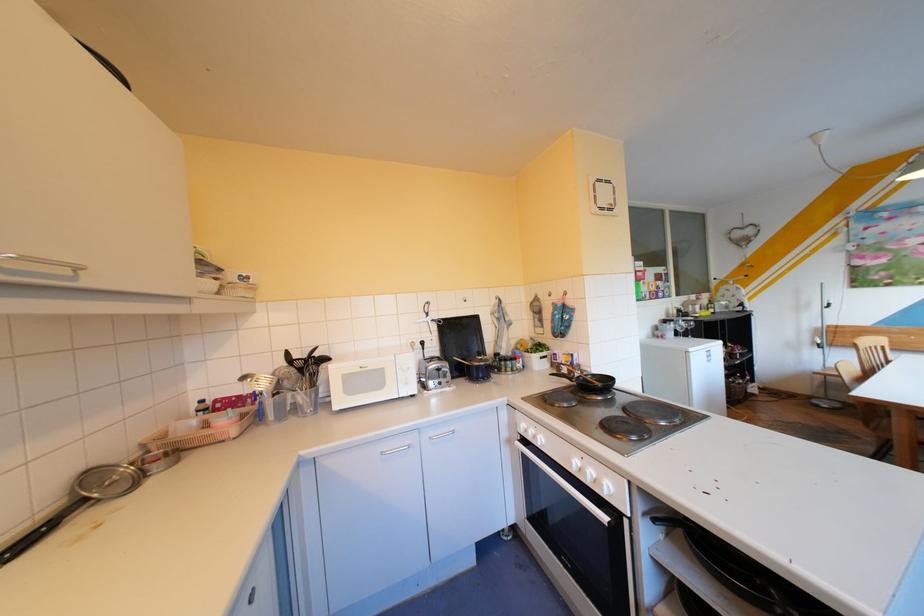
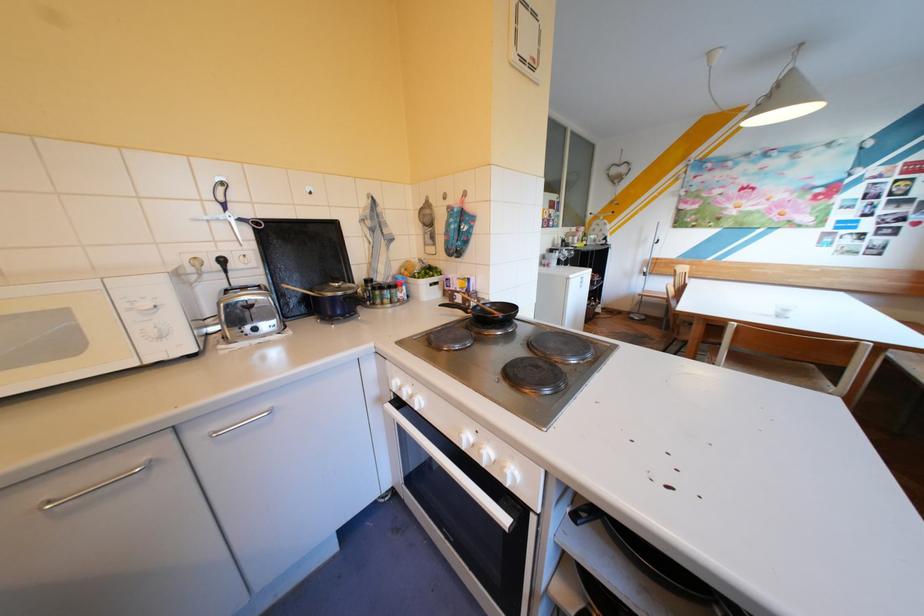
The point at (445, 320) is marked in the first image. Where is the corresponding point in the second image?

(253, 219)